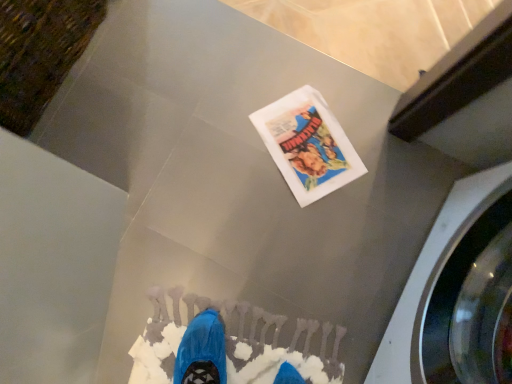
You are a GUI agent. You are given a task and a screenshot of the screen. Output one action in this format:
    pyautogui.click(x=<x>, y=<y>)
    Task: Click on the free space to the left of white paper flyer at center
    The height and width of the screenshot is (384, 512).
    Given the screenshot: What is the action you would take?
    pyautogui.click(x=230, y=132)